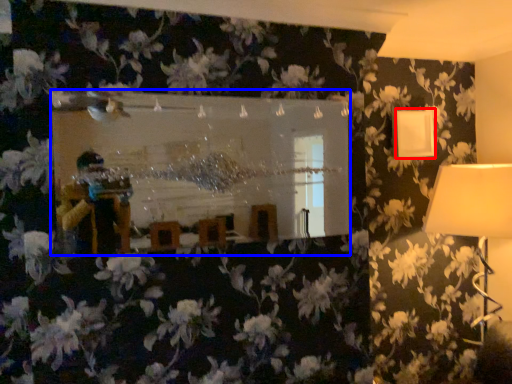
Question: Among these objects, which one is nearest to the camera, lamp (highlighted by a red box) or mirror (highlighted by a blue box)?

Choices:
 (A) lamp
 (B) mirror

Answer: (B)